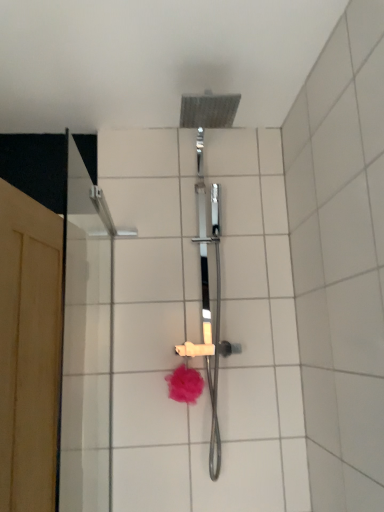
Measure the distance between point (171, 386) and camera.

5.48 feet.

What do you see at coordinates (29, 350) in the screenshot?
I see `wooden screen door at left` at bounding box center [29, 350].

What is the approximate height of white ceramic tile at upper center?

It is 5.32 feet.

The width and height of the screenshot is (384, 512). Find the location of `pink fluffy bath puff at center`. pink fluffy bath puff at center is located at coordinates (185, 384).

From the image's perspective, is wooden screen door at left above or below white ceramic tile at upper center?

Based on their image positions, wooden screen door at left is located beneath white ceramic tile at upper center.

Considering the positions of objects wooden screen door at left and white ceramic tile at upper center in the image provided, who is more to the right, wooden screen door at left or white ceramic tile at upper center?

Positioned to the right is white ceramic tile at upper center.

Does point (3, 232) lie behind point (379, 126)?

Yes.

Is wooden screen door at left turned away from white ceramic tile at upper center?

Absolutely, wooden screen door at left is directed away from white ceramic tile at upper center.

From the image's perspective, who appears lower, pink fluffy bath puff at center or white ceramic tile at upper center?

pink fluffy bath puff at center appears lower in the image.

Between pink fluffy bath puff at center and white ceramic tile at upper center, which one has smaller width?

With smaller width is white ceramic tile at upper center.

Is pink fluffy bath puff at center oriented towards white ceramic tile at upper center?

No, pink fluffy bath puff at center is not turned towards white ceramic tile at upper center.

Does pink fluffy bath puff at center contain white ceramic tile at upper center?

No, white ceramic tile at upper center is not surrounded by pink fluffy bath puff at center.

Is white ceramic tile at upper center oriented towards pink fluffy bath puff at center?

Yes, white ceramic tile at upper center faces towards pink fluffy bath puff at center.

Considering the relative positions of white ceramic tile at upper center and pink fluffy bath puff at center in the image provided, is white ceramic tile at upper center to the left of pink fluffy bath puff at center from the viewer's perspective?

In fact, white ceramic tile at upper center is to the right of pink fluffy bath puff at center.

Is white ceramic tile at upper center positioned far away from pink fluffy bath puff at center?

No.

Can you confirm if white ceramic tile at upper center is thinner than pink fluffy bath puff at center?

Yes.

Would you say wooden screen door at left is part of white ceramic tile at upper center's contents?

No, white ceramic tile at upper center does not contain wooden screen door at left.

Is white ceramic tile at upper center wider or thinner than wooden screen door at left?

Considering their sizes, white ceramic tile at upper center looks slimmer than wooden screen door at left.

How far apart are white ceramic tile at upper center and wooden screen door at left?

white ceramic tile at upper center and wooden screen door at left are 38.86 inches apart from each other.

Is white ceramic tile at upper center facing towards wooden screen door at left?

Yes, white ceramic tile at upper center is turned towards wooden screen door at left.

Which point is more distant from viewer, [25,305] or [186,372]?

Positioned behind is point [186,372].

Considering the sizes of wooden screen door at left and pink fluffy bath puff at center in the image, is wooden screen door at left taller or shorter than pink fluffy bath puff at center?

Considering their sizes, wooden screen door at left has more height than pink fluffy bath puff at center.

From a real-world perspective, who is located lower, wooden screen door at left or pink fluffy bath puff at center?

pink fluffy bath puff at center, from a real-world perspective.

Between pink fluffy bath puff at center and wooden screen door at left, which one has smaller width?

Thinner between the two is pink fluffy bath puff at center.

Does pink fluffy bath puff at center turn towards wooden screen door at left?

No, pink fluffy bath puff at center is not oriented towards wooden screen door at left.

Considering the relative positions of pink fluffy bath puff at center and wooden screen door at left in the image provided, is pink fluffy bath puff at center to the left or to the right of wooden screen door at left?

Clearly, pink fluffy bath puff at center is on the right of wooden screen door at left in the image.

This screenshot has height=512, width=384. There is a wooden screen door at left. Find the location of `ceramic tile above it (from a real-world perspective)`. ceramic tile above it (from a real-world perspective) is located at coordinates (341, 259).

Identify the location of flower that appears below the white ceramic tile at upper center (from the image's perspective). The width and height of the screenshot is (384, 512). (185, 384).

From the picture: Estimate the real-world distances between objects in this image. Which object is further from wooden screen door at left, pink fluffy bath puff at center or white ceramic tile at upper center?

white ceramic tile at upper center is further to wooden screen door at left.

Considering their positions, is pink fluffy bath puff at center positioned further to white ceramic tile at upper center than wooden screen door at left?

Based on the image, wooden screen door at left appears to be further to white ceramic tile at upper center.

When comparing their distances from pink fluffy bath puff at center, does white ceramic tile at upper center or wooden screen door at left seem further?

white ceramic tile at upper center.

Looking at the image, which one is located closer to white ceramic tile at upper center, wooden screen door at left or pink fluffy bath puff at center?

pink fluffy bath puff at center lies closer to white ceramic tile at upper center than the other object.

Based on their spatial positions, is white ceramic tile at upper center or pink fluffy bath puff at center further from wooden screen door at left?

white ceramic tile at upper center.

Which object lies nearer to the anchor point pink fluffy bath puff at center, wooden screen door at left or white ceramic tile at upper center?

wooden screen door at left lies closer to pink fluffy bath puff at center than the other object.

At what (x,y) coordinates should I click in order to perform the action: click on flower situated between wooden screen door at left and white ceramic tile at upper center from left to right. Please return your answer as a coordinate pair (x, y). This screenshot has height=512, width=384. Looking at the image, I should click on (185, 384).